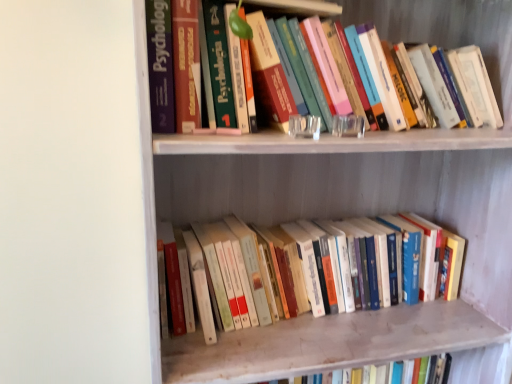
Locate an element on the screen. hardcover books at lower center, arranged as the 1th book when ordered from the bottom is located at coordinates (292, 271).

Identify the location of hardcover book at upper center, which ranks as the 1th book in top-to-bottom order. (448, 25).

The width and height of the screenshot is (512, 384). Find the location of `book above the hardcover books at lower center, which is the second book from top to bottom (from a real-world perspective)`. book above the hardcover books at lower center, which is the second book from top to bottom (from a real-world perspective) is located at coordinates click(448, 25).

Which of these two, hardcover book at upper center, which ranks as the 1th book in top-to-bottom order, or hardcover books at lower center, arranged as the 1th book when ordered from the bottom, is wider?

hardcover book at upper center, which ranks as the 1th book in top-to-bottom order.

From a real-world perspective, is hardcover book at upper center, the 2th book from the bottom, on hardcover books at lower center, which is the second book from top to bottom?

Yes, from a real-world perspective, hardcover book at upper center, the 2th book from the bottom, is on top of hardcover books at lower center, which is the second book from top to bottom.

Is hardcover book at upper center, the 2th book from the bottom, facing away from hardcover books at lower center, arranged as the 1th book when ordered from the bottom?

hardcover book at upper center, the 2th book from the bottom, is not turned away from hardcover books at lower center, arranged as the 1th book when ordered from the bottom.

Based on the photo, from the image's perspective, which object appears higher, hardcover books at lower center, arranged as the 1th book when ordered from the bottom, or hardcover book at upper center, the 2th book from the bottom?

hardcover book at upper center, the 2th book from the bottom, from the image's perspective.

Does hardcover books at lower center, arranged as the 1th book when ordered from the bottom, have a lesser height compared to hardcover book at upper center, the 2th book from the bottom?

Indeed, hardcover books at lower center, arranged as the 1th book when ordered from the bottom, has a lesser height compared to hardcover book at upper center, the 2th book from the bottom.

Can you tell me how much hardcover books at lower center, arranged as the 1th book when ordered from the bottom, and hardcover book at upper center, the 2th book from the bottom, differ in facing direction?

There is a 0.00045-degree angle between the facing directions of hardcover books at lower center, arranged as the 1th book when ordered from the bottom, and hardcover book at upper center, the 2th book from the bottom.

Which is more to the left, wooden bookshelf at upper center or hardcover books at lower center, which is the second book from top to bottom?

hardcover books at lower center, which is the second book from top to bottom.

Is wooden bookshelf at upper center positioned beyond the bounds of hardcover books at lower center, arranged as the 1th book when ordered from the bottom?

Yes.

Which object is further away from the camera, hardcover book at upper center, the 2th book from the bottom, or wooden bookshelf at upper center?

hardcover book at upper center, the 2th book from the bottom, is more distant.

Which is more to the right, hardcover book at upper center, the 2th book from the bottom, or wooden bookshelf at upper center?

From the viewer's perspective, wooden bookshelf at upper center appears more on the right side.

Is hardcover book at upper center, which ranks as the 1th book in top-to-bottom order, shorter than wooden bookshelf at upper center?

Yes, hardcover book at upper center, which ranks as the 1th book in top-to-bottom order, is shorter than wooden bookshelf at upper center.

The height and width of the screenshot is (384, 512). What are the coordinates of `shelf below the hardcover book at upper center, which ranks as the 1th book in top-to-bottom order (from a real-world perspective)` in the screenshot? It's located at (361, 200).

Considering the sizes of objects wooden bookshelf at upper center and hardcover book at upper center, which ranks as the 1th book in top-to-bottom order, in the image provided, who is taller, wooden bookshelf at upper center or hardcover book at upper center, which ranks as the 1th book in top-to-bottom order,?

wooden bookshelf at upper center is taller.

Which of these two, wooden bookshelf at upper center or hardcover book at upper center, the 2th book from the bottom, is wider?

wooden bookshelf at upper center.

From a real-world perspective, who is located lower, wooden bookshelf at upper center or hardcover book at upper center, the 2th book from the bottom?

From a 3D spatial view, wooden bookshelf at upper center is below.

Is hardcover books at lower center, arranged as the 1th book when ordered from the bottom, behind wooden bookshelf at upper center?

Yes, hardcover books at lower center, arranged as the 1th book when ordered from the bottom, is behind wooden bookshelf at upper center.

Locate an element on the screen. shelf that is on the right side of hardcover books at lower center, which is the second book from top to bottom is located at coordinates (361, 200).

Which object is positioned more to the right, hardcover books at lower center, which is the second book from top to bottom, or wooden bookshelf at upper center?

wooden bookshelf at upper center.

Consider the image. Is wooden bookshelf at upper center completely or partially inside hardcover books at lower center, arranged as the 1th book when ordered from the bottom?

That's incorrect, wooden bookshelf at upper center is not inside hardcover books at lower center, arranged as the 1th book when ordered from the bottom.

Identify the location of book lying behind the hardcover book at upper center, which ranks as the 1th book in top-to-bottom order. (292, 271).

Locate an element on the screen. Image resolution: width=512 pixels, height=384 pixels. book lying above the hardcover books at lower center, arranged as the 1th book when ordered from the bottom (from the image's perspective) is located at coordinates (448, 25).

Considering their positions, is hardcover books at lower center, which is the second book from top to bottom, positioned closer to wooden bookshelf at upper center than hardcover book at upper center, which ranks as the 1th book in top-to-bottom order?

hardcover books at lower center, which is the second book from top to bottom.

Which object lies further to the anchor point wooden bookshelf at upper center, hardcover book at upper center, the 2th book from the bottom, or hardcover books at lower center, arranged as the 1th book when ordered from the bottom?

hardcover book at upper center, the 2th book from the bottom, lies further to wooden bookshelf at upper center than the other object.

Based on their spatial positions, is hardcover book at upper center, which ranks as the 1th book in top-to-bottom order, or wooden bookshelf at upper center further from hardcover books at lower center, which is the second book from top to bottom?

hardcover book at upper center, which ranks as the 1th book in top-to-bottom order, lies further to hardcover books at lower center, which is the second book from top to bottom, than the other object.

From the image, which object appears to be farther from hardcover book at upper center, the 2th book from the bottom, wooden bookshelf at upper center or hardcover books at lower center, which is the second book from top to bottom?

hardcover books at lower center, which is the second book from top to bottom.

Looking at the image, which one is located further to hardcover books at lower center, which is the second book from top to bottom, wooden bookshelf at upper center or hardcover book at upper center, the 2th book from the bottom?

hardcover book at upper center, the 2th book from the bottom, is positioned further to the anchor hardcover books at lower center, which is the second book from top to bottom.

From the picture: Considering their positions, is hardcover books at lower center, arranged as the 1th book when ordered from the bottom, positioned further to hardcover book at upper center, which ranks as the 1th book in top-to-bottom order, than wooden bookshelf at upper center?

hardcover books at lower center, arranged as the 1th book when ordered from the bottom, is further to hardcover book at upper center, which ranks as the 1th book in top-to-bottom order.

Identify the location of shelf between hardcover book at upper center, which ranks as the 1th book in top-to-bottom order, and hardcover books at lower center, arranged as the 1th book when ordered from the bottom, from top to bottom. The width and height of the screenshot is (512, 384). (361, 200).